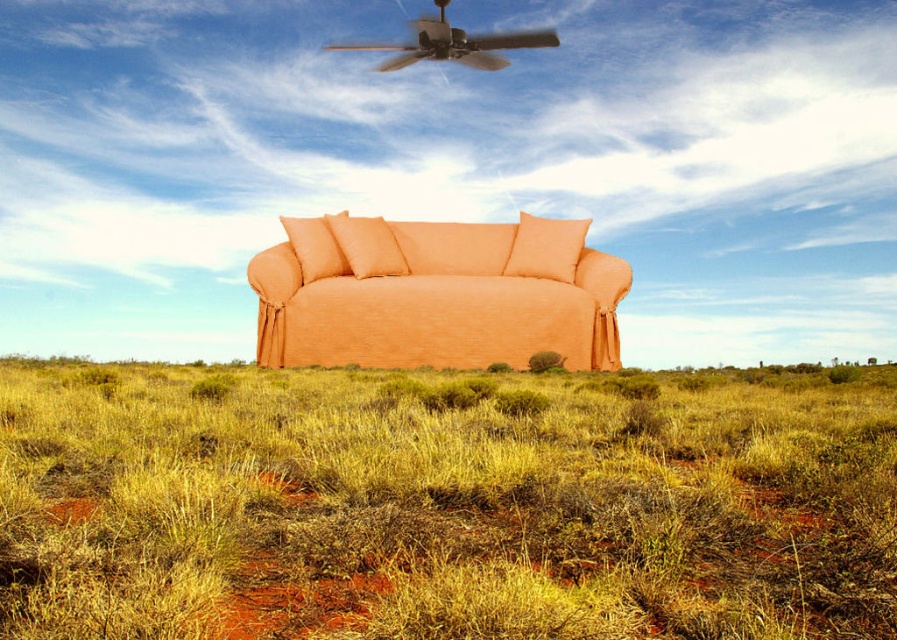
Question: Which of the following is the closest to the observer?

Choices:
 (A) yellow dry grass at lower center
 (B) orange fabric couch at center
 (C) orange fabric pillow at center

Answer: (A)

Question: Does orange fabric couch at center appear under orange fabric pillow at center?

Choices:
 (A) yes
 (B) no

Answer: (A)

Question: In this image, where is yellow dry grass at lower center located relative to orange fabric couch at center?

Choices:
 (A) right
 (B) left

Answer: (B)

Question: Does orange fabric couch at center have a smaller size compared to orange fabric pillow at center?

Choices:
 (A) no
 (B) yes

Answer: (A)

Question: Which point is closer to the camera?

Choices:
 (A) (536, 216)
 (B) (207, 481)
 (C) (342, 316)

Answer: (B)

Question: Which object is closer to the camera taking this photo?

Choices:
 (A) yellow dry grass at lower center
 (B) orange fabric pillow at center
 (C) orange fabric couch at center

Answer: (A)